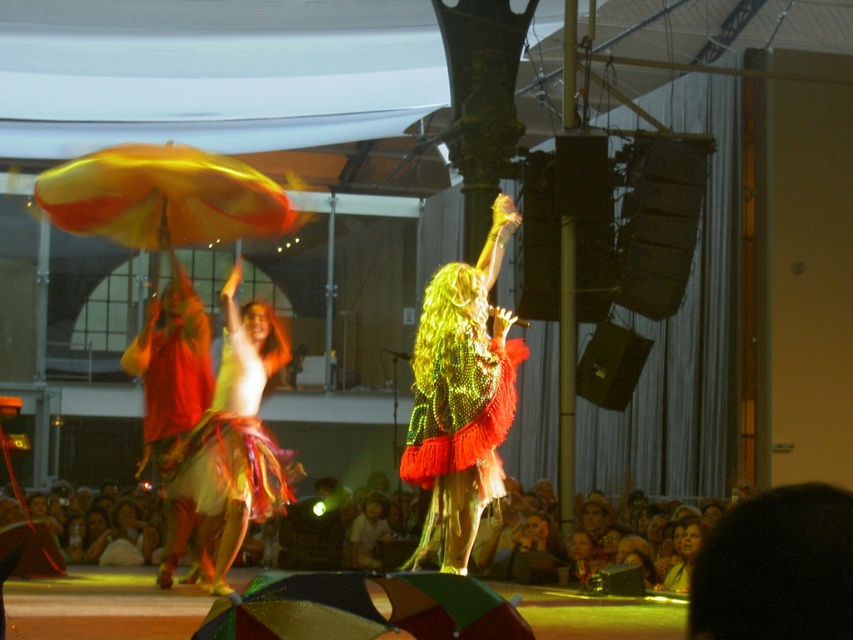
Who is higher up, matte skin audience at lower center or shiny metallic skirt at center?

shiny metallic skirt at center

Between matte skin audience at lower center and shiny metallic skirt at center, which one has more height?

Standing taller between the two is shiny metallic skirt at center.

What do you see at coordinates (590, 540) in the screenshot? This screenshot has height=640, width=853. I see `matte skin audience at lower center` at bounding box center [590, 540].

Image resolution: width=853 pixels, height=640 pixels. In order to click on matte skin audience at lower center in this screenshot , I will do `click(590, 540)`.

Which is above, matte skin audience at lower center or green sequined dress at center?

Positioned higher is green sequined dress at center.

The width and height of the screenshot is (853, 640). I want to click on matte skin audience at lower center, so click(590, 540).

In the scene shown: Between green sequined dress at center and shiny metallic skirt at center, which one has more height?

Standing taller between the two is green sequined dress at center.

Does green sequined dress at center lie behind shiny metallic skirt at center?

No.

Does point (447, 445) come in front of point (280, 480)?

Yes, it is in front of point (280, 480).

You are a GUI agent. You are given a task and a screenshot of the screen. Output one action in this format:
    pyautogui.click(x=<x>, y=<y>)
    Task: Click on the green sequined dress at center
    This screenshot has width=853, height=640.
    Given the screenshot: What is the action you would take?
    pyautogui.click(x=461, y=396)